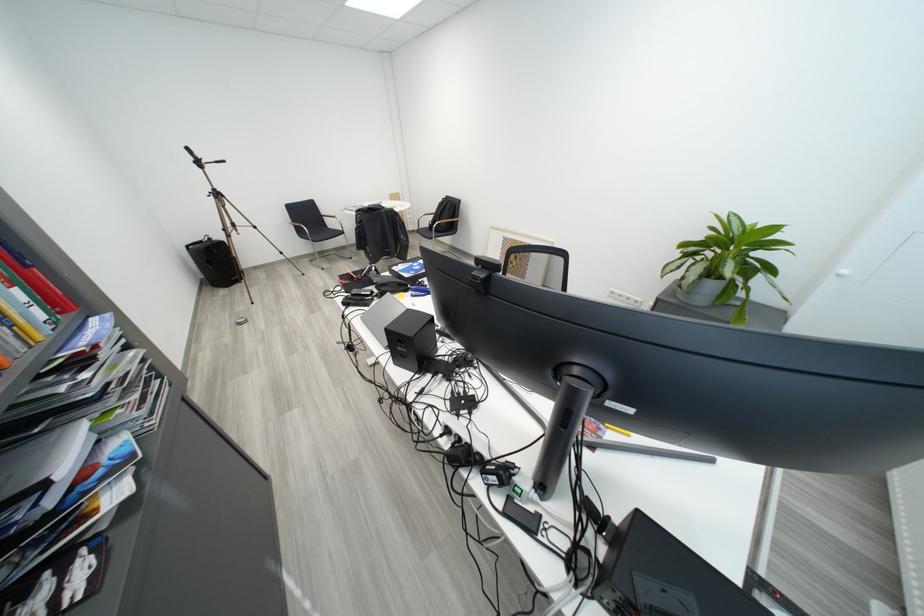
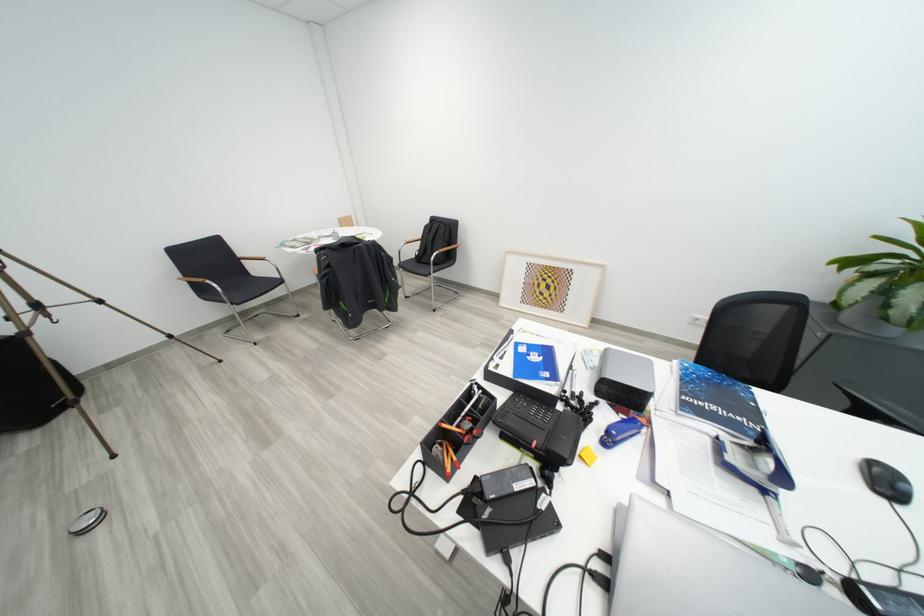
Locate, in the second image, the point that corresponds to point (419, 294) in the first image.

(600, 438)